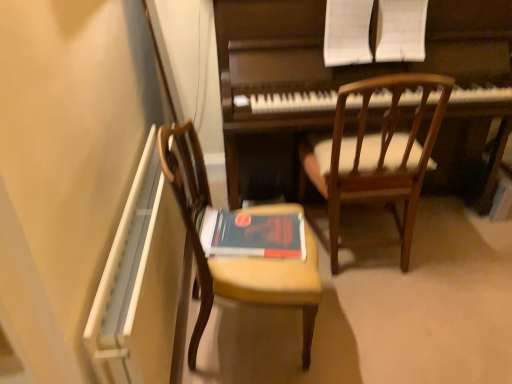
This screenshot has width=512, height=384. What do you see at coordinates (252, 234) in the screenshot?
I see `hardcover book at center` at bounding box center [252, 234].

This screenshot has height=384, width=512. Find the location of `dark wood piano at center`. dark wood piano at center is located at coordinates (328, 73).

What do you see at coordinates (241, 244) in the screenshot?
I see `wooden chair at left, positioned as the first chair in left-to-right order` at bounding box center [241, 244].

Locate an element on the screen. wooden chair at upper right, the 1th chair from the right is located at coordinates (374, 160).

Does hardcover book at center turn towards dark wood piano at center?

No, hardcover book at center is not turned towards dark wood piano at center.

Looking at their sizes, would you say hardcover book at center is wider or thinner than dark wood piano at center?

hardcover book at center is thinner than dark wood piano at center.

Is dark wood piano at center inside hardcover book at center?

No, dark wood piano at center is not surrounded by hardcover book at center.

Can you confirm if wooden chair at left, marked as the 2th chair in a right-to-left arrangement, is wider than hardcover book at center?

Indeed, wooden chair at left, marked as the 2th chair in a right-to-left arrangement, has a greater width compared to hardcover book at center.

Is wooden chair at left, marked as the 2th chair in a right-to-left arrangement, facing towards hardcover book at center?

Yes.

Is point (217, 285) farther from camera compared to point (258, 221)?

No, it is not.

Can you confirm if wooden chair at left, marked as the 2th chair in a right-to-left arrangement, is taller than dark wood piano at center?

In fact, wooden chair at left, marked as the 2th chair in a right-to-left arrangement, may be shorter than dark wood piano at center.

The width and height of the screenshot is (512, 384). Identify the location of the 2nd chair below the dark wood piano at center (from the image's perspective). (241, 244).

Considering the points (248, 216) and (259, 102), which point is in front, point (248, 216) or point (259, 102)?

Point (248, 216)

From a real-world perspective, is wooden chair at left, positioned as the first chair in left-to-right order, positioned above or below dark wood piano at center?

Clearly, from a real-world perspective, wooden chair at left, positioned as the first chair in left-to-right order, is below dark wood piano at center.

How many degrees apart are the facing directions of dark wood piano at center and wooden chair at upper right, the 1th chair from the right?

There is a 177-degree angle between the facing directions of dark wood piano at center and wooden chair at upper right, the 1th chair from the right.

Visually, is dark wood piano at center positioned to the left or to the right of wooden chair at upper right, the 1th chair from the right?

dark wood piano at center is positioned on wooden chair at upper right, the 1th chair from the right,'s right side.

Which is behind, point (430, 65) or point (392, 173)?

The point (430, 65) is farther from the camera.

Is dark wood piano at center taller or shorter than wooden chair at upper right, the second chair from the left?

Considering their sizes, dark wood piano at center has more height than wooden chair at upper right, the second chair from the left.

Is wooden chair at upper right, the second chair from the left, looking in the opposite direction of dark wood piano at center?

Yes, wooden chair at upper right, the second chair from the left, is positioned with its back facing dark wood piano at center.

From the image's perspective, which one is positioned higher, wooden chair at upper right, the 1th chair from the right, or dark wood piano at center?

dark wood piano at center is shown above in the image.

Considering the sizes of objects wooden chair at upper right, the 1th chair from the right, and dark wood piano at center in the image provided, who is shorter, wooden chair at upper right, the 1th chair from the right, or dark wood piano at center?

With less height is wooden chair at upper right, the 1th chair from the right.

Is wooden chair at upper right, the second chair from the left, further to the viewer compared to wooden chair at left, marked as the 2th chair in a right-to-left arrangement?

Yes, it is.

Looking at the image, does wooden chair at upper right, the second chair from the left, seem bigger or smaller compared to wooden chair at left, positioned as the first chair in left-to-right order?

wooden chair at upper right, the second chair from the left, is bigger than wooden chair at left, positioned as the first chair in left-to-right order.

Is wooden chair at upper right, the 1th chair from the right, taller or shorter than wooden chair at left, marked as the 2th chair in a right-to-left arrangement?

Considering their sizes, wooden chair at upper right, the 1th chair from the right, has more height than wooden chair at left, marked as the 2th chair in a right-to-left arrangement.

Which object is wider, wooden chair at upper right, the 1th chair from the right, or wooden chair at left, positioned as the first chair in left-to-right order?

With larger width is wooden chair at upper right, the 1th chair from the right.

Relative to wooden chair at upper right, the second chair from the left, is wooden chair at left, marked as the 2th chair in a right-to-left arrangement, in front or behind?

Clearly, wooden chair at left, marked as the 2th chair in a right-to-left arrangement, is in front of wooden chair at upper right, the second chair from the left.

Identify the location of chair above the wooden chair at left, positioned as the first chair in left-to-right order (from the image's perspective). [374, 160].

From a real-world perspective, is wooden chair at left, positioned as the first chair in left-to-right order, on top of wooden chair at upper right, the 1th chair from the right?

No.

The height and width of the screenshot is (384, 512). Identify the location of piano behind the hardcover book at center. (328, 73).

Find the location of a particular element. The width and height of the screenshot is (512, 384). chair below the hardcover book at center (from the image's perspective) is located at coordinates (241, 244).

Based on their spatial positions, is hardcover book at center or dark wood piano at center closer to wooden chair at upper right, the 1th chair from the right?

dark wood piano at center is closer to wooden chair at upper right, the 1th chair from the right.

Estimate the real-world distances between objects in this image. Which object is further from wooden chair at left, marked as the 2th chair in a right-to-left arrangement, wooden chair at upper right, the 1th chair from the right, or hardcover book at center?

wooden chair at upper right, the 1th chair from the right, lies further to wooden chair at left, marked as the 2th chair in a right-to-left arrangement, than the other object.

From the image, which object appears to be nearer to wooden chair at left, marked as the 2th chair in a right-to-left arrangement, dark wood piano at center or wooden chair at upper right, the second chair from the left?

wooden chair at upper right, the second chair from the left, is closer to wooden chair at left, marked as the 2th chair in a right-to-left arrangement.

In the scene shown: Considering their positions, is wooden chair at left, marked as the 2th chair in a right-to-left arrangement, positioned further to dark wood piano at center than wooden chair at upper right, the 1th chair from the right?

The object further to dark wood piano at center is wooden chair at left, marked as the 2th chair in a right-to-left arrangement.

Estimate the real-world distances between objects in this image. Which object is closer to dark wood piano at center, hardcover book at center or wooden chair at upper right, the second chair from the left?

The object closer to dark wood piano at center is wooden chair at upper right, the second chair from the left.

Based on their spatial positions, is wooden chair at upper right, the 1th chair from the right, or wooden chair at left, marked as the 2th chair in a right-to-left arrangement, further from dark wood piano at center?

The object further to dark wood piano at center is wooden chair at left, marked as the 2th chair in a right-to-left arrangement.

Based on their spatial positions, is hardcover book at center or wooden chair at upper right, the 1th chair from the right, closer to wooden chair at left, marked as the 2th chair in a right-to-left arrangement?

The object closer to wooden chair at left, marked as the 2th chair in a right-to-left arrangement, is hardcover book at center.

Based on their spatial positions, is wooden chair at upper right, the 1th chair from the right, or dark wood piano at center further from hardcover book at center?

dark wood piano at center is further to hardcover book at center.

Locate an element on the screen. paperback book between wooden chair at left, positioned as the first chair in left-to-right order, and wooden chair at upper right, the second chair from the left, in the horizontal direction is located at coordinates (252, 234).

Find the location of a particular element. The width and height of the screenshot is (512, 384). chair located between hardcover book at center and dark wood piano at center in the left-right direction is located at coordinates (374, 160).

In order to click on chair between wooden chair at left, marked as the 2th chair in a right-to-left arrangement, and dark wood piano at center from left to right in this screenshot , I will do `click(374, 160)`.

Image resolution: width=512 pixels, height=384 pixels. Find the location of `paperback book between dark wood piano at center and wooden chair at left, marked as the 2th chair in a right-to-left arrangement, in the vertical direction`. paperback book between dark wood piano at center and wooden chair at left, marked as the 2th chair in a right-to-left arrangement, in the vertical direction is located at coordinates (252, 234).